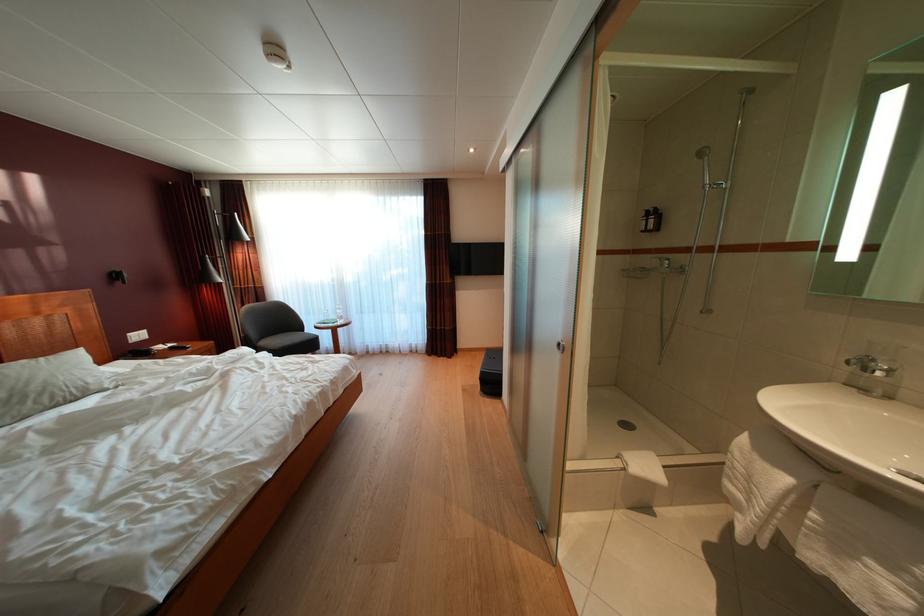
This screenshot has width=924, height=616. Find the location of `dispenser pump`. dispenser pump is located at coordinates (653, 223).